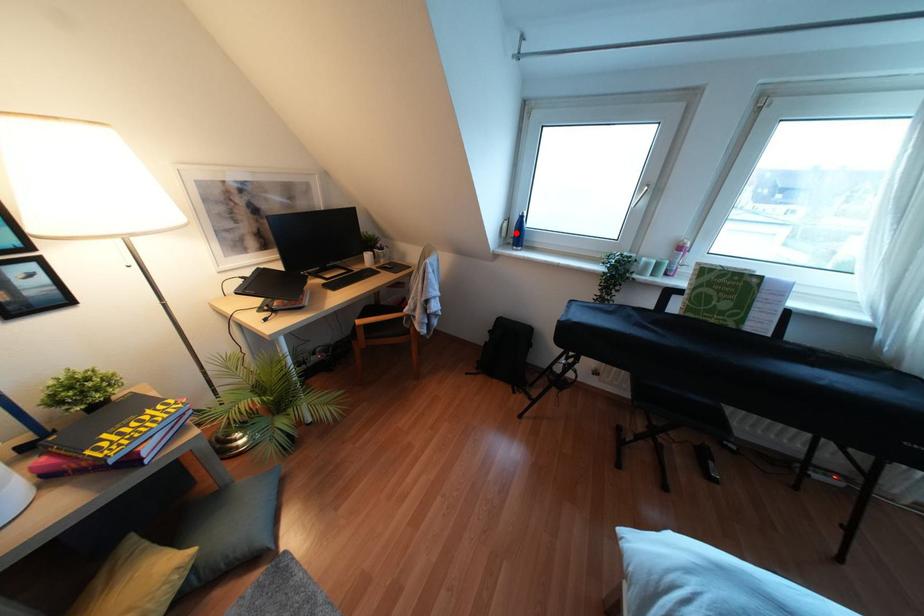
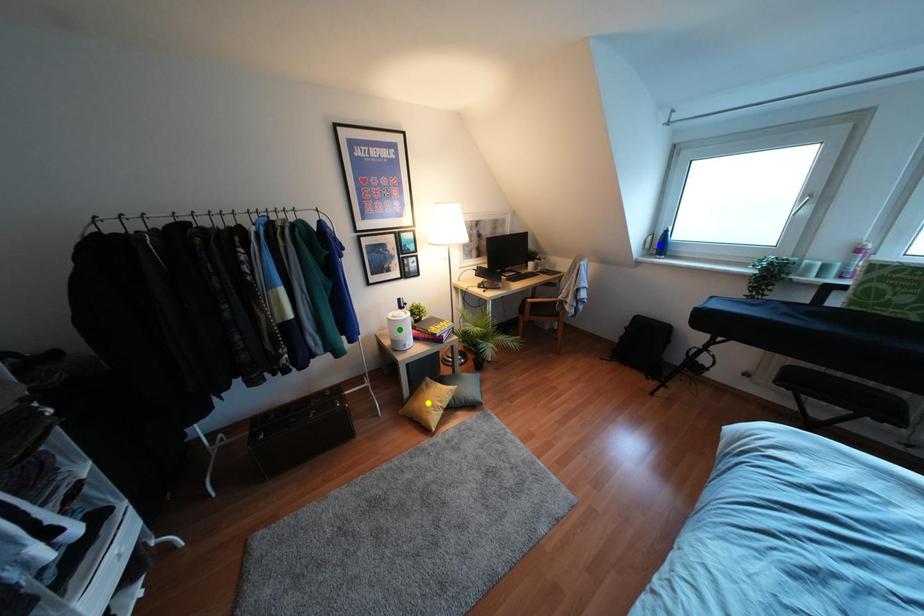
Question: I am providing you with two images of the same scene from different viewpoints. A red point is marked on the first image. You are given multiple points on the second image. Which point in image 2 represents the same 3d spot as the red point in image 1?

Choices:
 (A) blue point
 (B) green point
 (C) yellow point

Answer: (A)